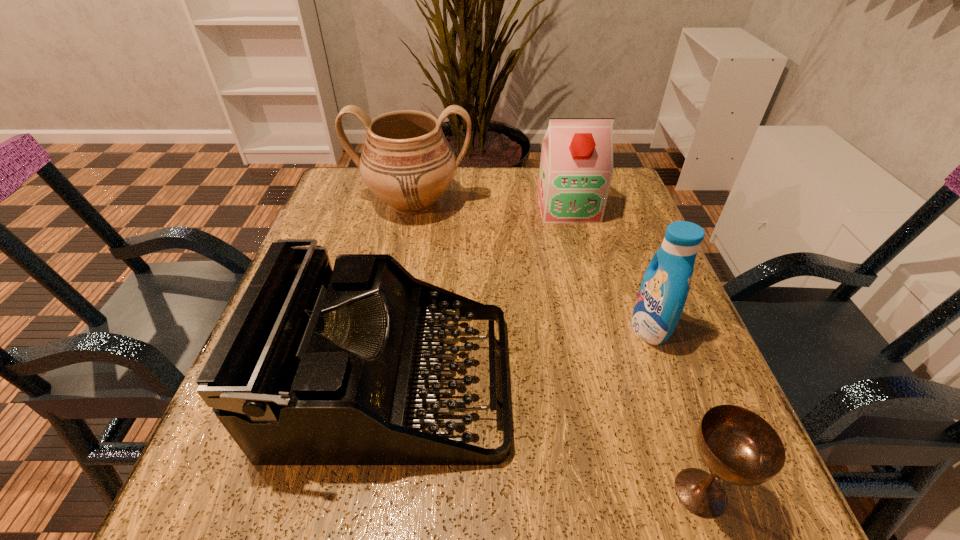
Where is `free point between the chalice and the soya milk`? This screenshot has height=540, width=960. free point between the chalice and the soya milk is located at coordinates (635, 349).

The image size is (960, 540). What are the coordinates of `free space between the detergent and the soya milk` in the screenshot? It's located at (609, 267).

Where is `free space between the urn and the shortest object`? Image resolution: width=960 pixels, height=540 pixels. free space between the urn and the shortest object is located at coordinates (557, 347).

The width and height of the screenshot is (960, 540). Find the location of `free space between the detergent and the urn`. free space between the detergent and the urn is located at coordinates (531, 265).

At what (x,y) coordinates should I click in order to perform the action: click on blank region between the typewriter and the soya milk. Please return your answer as a coordinate pair (x, y). The width and height of the screenshot is (960, 540). Looking at the image, I should click on (480, 294).

Where is `free space that is in between the detergent and the shortest object`? free space that is in between the detergent and the shortest object is located at coordinates (675, 410).

Image resolution: width=960 pixels, height=540 pixels. Identify the location of empty space that is in between the second shortest object and the detergent. (521, 355).

You are a GUI agent. You are given a task and a screenshot of the screen. Output one action in this format:
    pyautogui.click(x=<x>, y=<y>)
    Task: Click on the vacant space that's between the fourth tallest object and the detergent
    The height and width of the screenshot is (540, 960).
    Given the screenshot: What is the action you would take?
    pyautogui.click(x=521, y=355)

Where is `unoccupied position between the shortest object and the soya milk`? unoccupied position between the shortest object and the soya milk is located at coordinates (635, 349).

Image resolution: width=960 pixels, height=540 pixels. Identify the location of vacant space that is in between the soya milk and the chalice. (635, 349).